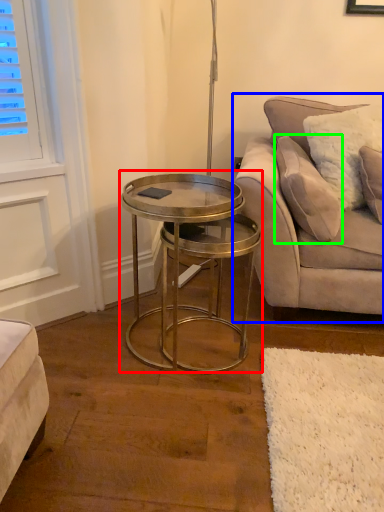
Question: Which object is positioned closest to coffee table (highlighted by a red box)? Select from studio couch (highlighted by a blue box) and pillow (highlighted by a green box).

Choices:
 (A) studio couch
 (B) pillow

Answer: (A)